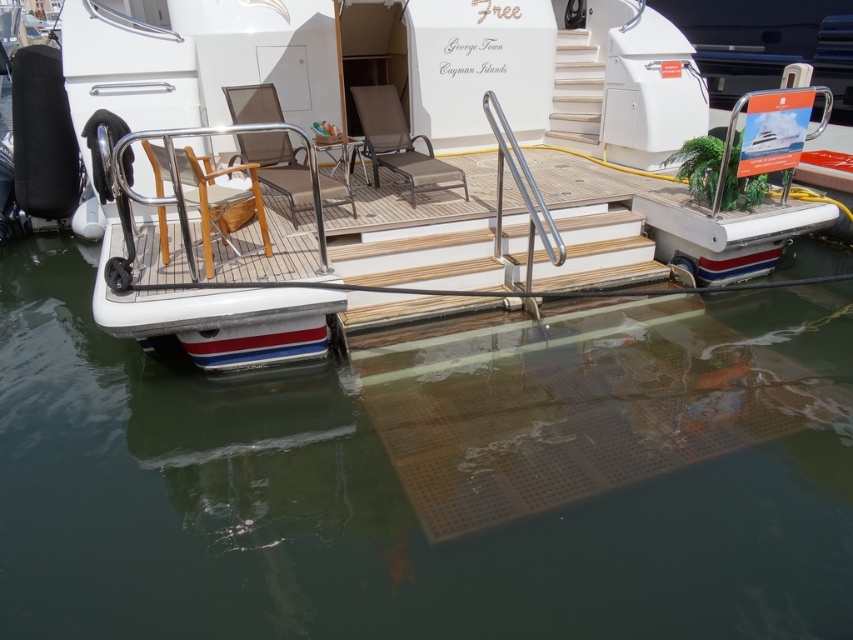
You are standing on the deck of the yacht named George Town Cayman Islands. You want to take a photo of the point at coordinates (474, 90). If your camera can focus up to 7 meters, will you be able to capture the point clearly?

The point at coordinates (474, 90) is 7.29 meters away from the camera. Since the camera can only focus up to 7 meters, it will not be able to capture the point clearly.

You are standing on the deck of the yacht and want to sit down. Where is the wooden chair at center located in terms of its 2D coordinates?

The wooden chair at center is located at the 2D coordinates of point (219, 198).